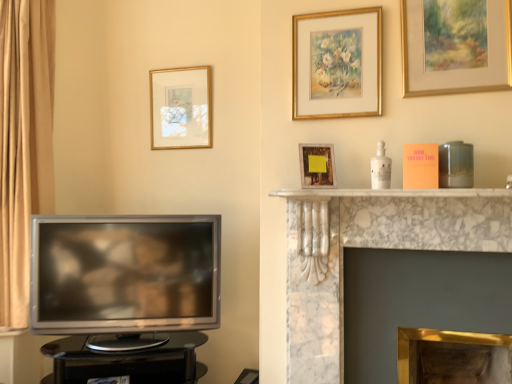
Question: Is gold/gilded picture frame at upper center, the second picture frame in the right-to-left sequence, facing away from gold metallic fireplace at center, the 2th fireplace positioned from the top?

Choices:
 (A) no
 (B) yes

Answer: (A)

Question: Is gold/gilded picture frame at upper center, the 3th picture frame positioned from the front, positioned before gold metallic fireplace at center, acting as the 1th fireplace starting from the bottom?

Choices:
 (A) no
 (B) yes

Answer: (A)

Question: Is gold/gilded picture frame at upper center, marked as the 2th picture frame in a back-to-front arrangement, to the left of gold metallic fireplace at center, the 2th fireplace positioned from the top, from the viewer's perspective?

Choices:
 (A) yes
 (B) no

Answer: (A)

Question: Can we say gold/gilded picture frame at upper center, the second picture frame in the right-to-left sequence, lies outside gold metallic fireplace at center, the 2th fireplace positioned from the top?

Choices:
 (A) yes
 (B) no

Answer: (A)

Question: Is gold/gilded picture frame at upper center, the 3th picture frame positioned from the front, far away from gold metallic fireplace at center, the 2th fireplace positioned from the top?

Choices:
 (A) no
 (B) yes

Answer: (B)

Question: Is gold/gilded picture frame at upper center, the second picture frame in the right-to-left sequence, positioned behind gold metallic fireplace at center, acting as the 1th fireplace starting from the bottom?

Choices:
 (A) yes
 (B) no

Answer: (A)

Question: From the image's perspective, is matte wooden picture frame at upper center, which is the 2th picture frame from left to right, below gold-framed picture at upper center, the 4th picture frame positioned from the right?

Choices:
 (A) no
 (B) yes

Answer: (B)

Question: From a real-world perspective, is matte wooden picture frame at upper center, acting as the 2th picture frame starting from the front, located beneath gold-framed picture at upper center, the 4th picture frame positioned from the right?

Choices:
 (A) no
 (B) yes

Answer: (B)

Question: Would you say matte wooden picture frame at upper center, which appears as the third picture frame when viewed from the right, is a long distance from gold-framed picture at upper center, marked as the 4th picture frame in a front-to-back arrangement?

Choices:
 (A) yes
 (B) no

Answer: (B)

Question: Can we say matte wooden picture frame at upper center, which ranks as the 3th picture frame in back-to-front order, lies outside gold-framed picture at upper center, the 4th picture frame positioned from the right?

Choices:
 (A) no
 (B) yes

Answer: (B)

Question: Can you confirm if matte wooden picture frame at upper center, which is the 2th picture frame from left to right, is positioned to the left of gold-framed picture at upper center, which is the first picture frame from left to right?

Choices:
 (A) no
 (B) yes

Answer: (A)

Question: Considering the relative sizes of matte wooden picture frame at upper center, which appears as the third picture frame when viewed from the right, and gold-framed picture at upper center, which is the first picture frame from left to right, in the image provided, is matte wooden picture frame at upper center, which appears as the third picture frame when viewed from the right, bigger than gold-framed picture at upper center, which is the first picture frame from left to right,?

Choices:
 (A) no
 (B) yes

Answer: (A)

Question: Considering the relative sizes of white marble fireplace at upper center and gold metallic fireplace at center, the 2th fireplace positioned from the top, in the image provided, is white marble fireplace at upper center taller than gold metallic fireplace at center, the 2th fireplace positioned from the top,?

Choices:
 (A) yes
 (B) no

Answer: (B)